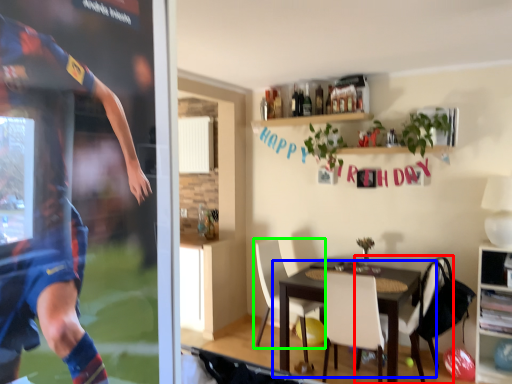
Question: Which is nearer to the chair (highlighted by a red box)? table (highlighted by a blue box) or chair (highlighted by a green box).

Choices:
 (A) table
 (B) chair

Answer: (A)